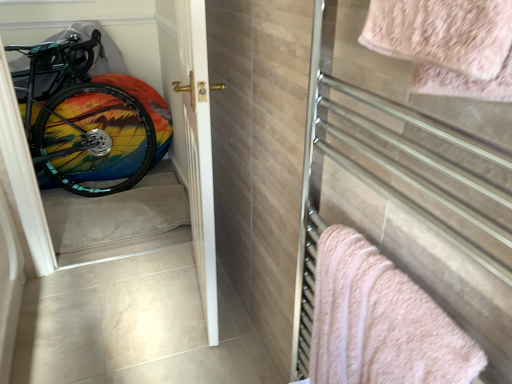
Question: Should I look upward or downward to see metallic towel rack at right?

Choices:
 (A) down
 (B) up

Answer: (A)

Question: Does metallic towel rack at right touch white glossy door at center?

Choices:
 (A) no
 (B) yes

Answer: (A)

Question: Is metallic towel rack at right to the right of white glossy door at center from the viewer's perspective?

Choices:
 (A) yes
 (B) no

Answer: (A)

Question: Is metallic towel rack at right at the left side of white glossy door at center?

Choices:
 (A) yes
 (B) no

Answer: (B)

Question: Is metallic towel rack at right facing towards white glossy door at center?

Choices:
 (A) yes
 (B) no

Answer: (B)

Question: From the image's perspective, is metallic towel rack at right above white glossy door at center?

Choices:
 (A) no
 (B) yes

Answer: (A)

Question: Is metallic towel rack at right smaller than white glossy door at center?

Choices:
 (A) no
 (B) yes

Answer: (B)

Question: Does pink fluffy towel at upper right, the second towel in the bottom-to-top sequence, have a greater height compared to pink fluffy towel at right, which ranks as the 2th towel in top-to-bottom order?

Choices:
 (A) yes
 (B) no

Answer: (B)

Question: Is pink fluffy towel at upper right, the second towel in the bottom-to-top sequence, thinner than pink fluffy towel at right, which is the 2th towel in front-to-back order?

Choices:
 (A) no
 (B) yes

Answer: (A)

Question: From the image's perspective, is pink fluffy towel at upper right, the first towel in the top-to-bottom sequence, located above pink fluffy towel at right, which is the 2th towel in front-to-back order?

Choices:
 (A) no
 (B) yes

Answer: (B)

Question: Is pink fluffy towel at upper right, the first towel in the top-to-bottom sequence, at the right side of pink fluffy towel at right, which is the 2th towel in front-to-back order?

Choices:
 (A) no
 (B) yes

Answer: (B)

Question: From a real-world perspective, does pink fluffy towel at upper right, which ranks as the second towel in back-to-front order, sit lower than pink fluffy towel at right, which ranks as the 2th towel in top-to-bottom order?

Choices:
 (A) no
 (B) yes

Answer: (A)

Question: Does white glossy door at center have a larger size compared to pink fluffy towel at upper right, the second towel in the bottom-to-top sequence?

Choices:
 (A) yes
 (B) no

Answer: (A)